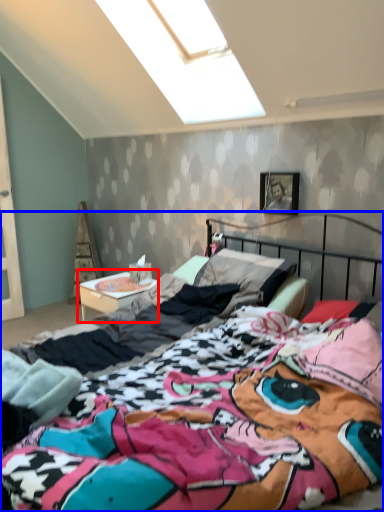
Question: Which of the following is the closest to the observer, nightstand (highlighted by a red box) or bed (highlighted by a blue box)?

Choices:
 (A) nightstand
 (B) bed

Answer: (B)